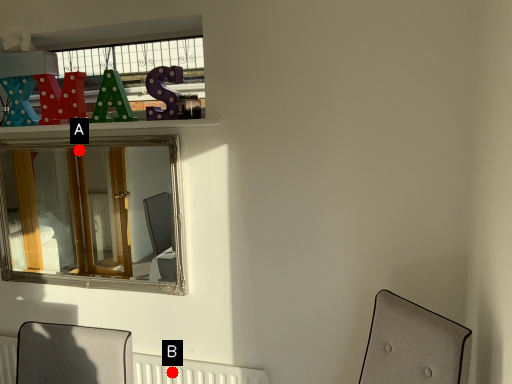
Question: Two points are circled on the image, labeled by A and B beside each circle. Which point is farther to the camera?

Choices:
 (A) A is further
 (B) B is further

Answer: (A)